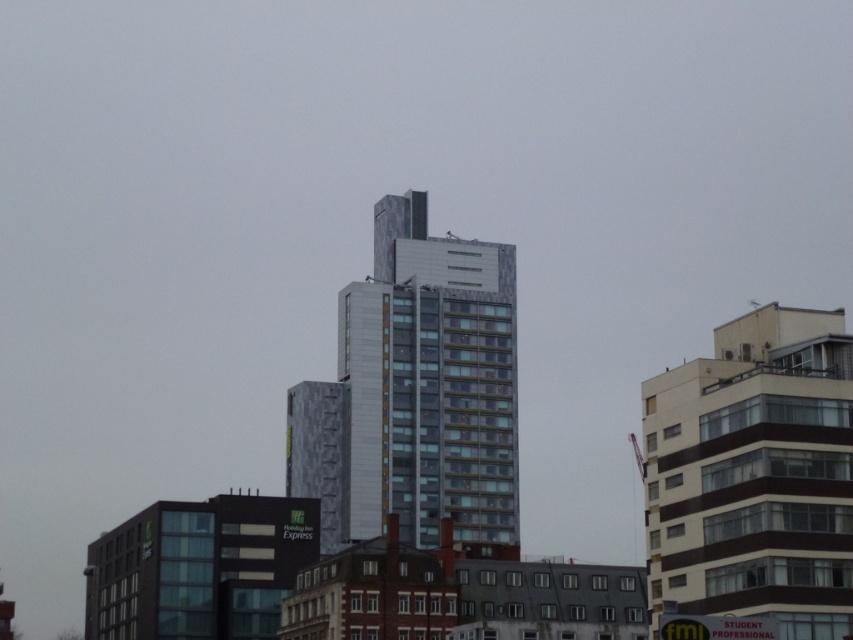
Can you confirm if metallic glass building at center is bigger than white textured building at right?

Yes, metallic glass building at center is bigger than white textured building at right.

Measure the distance between metallic glass building at center and white textured building at right.

metallic glass building at center and white textured building at right are 272.27 feet apart.

You are a GUI agent. You are given a task and a screenshot of the screen. Output one action in this format:
    pyautogui.click(x=<x>, y=<y>)
    Task: Click on the metallic glass building at center
    Image resolution: width=853 pixels, height=640 pixels.
    Given the screenshot: What is the action you would take?
    pyautogui.click(x=415, y=392)

Locate an element on the screen. This screenshot has height=640, width=853. metallic glass building at center is located at coordinates (415, 392).